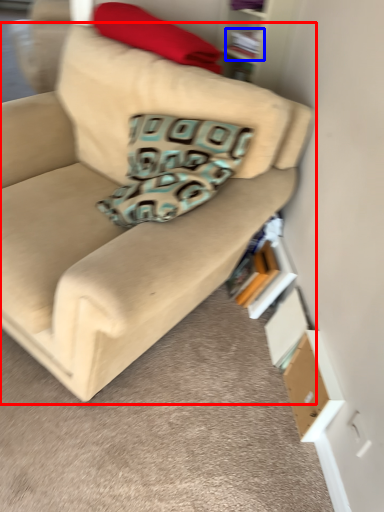
Question: Which point is further to the camera, studio couch (highlighted by a red box) or book (highlighted by a blue box)?

Choices:
 (A) studio couch
 (B) book

Answer: (B)